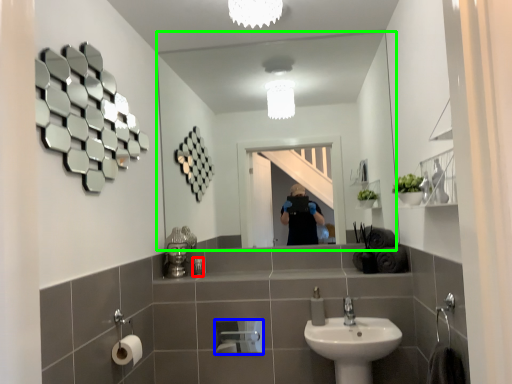
Question: Based on their relative distances, which object is nearer to toiletry (highlighted by a red box)? Choose from toilet paper (highlighted by a blue box) and mirror (highlighted by a green box).

Choices:
 (A) toilet paper
 (B) mirror

Answer: (A)